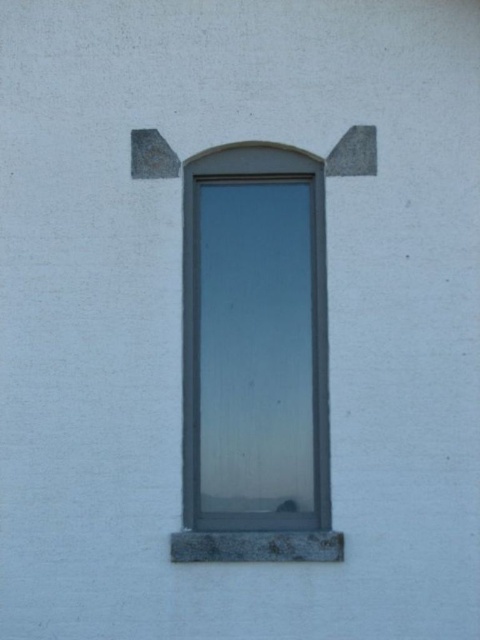
Which of these two, gray stone window frame at center or gray stone window sill at lower center, stands shorter?

Standing shorter between the two is gray stone window sill at lower center.

Does gray stone window frame at center come in front of gray stone window sill at lower center?

No.

Is point (212, 168) more distant than point (199, 561)?

Yes, it is.

The height and width of the screenshot is (640, 480). I want to click on gray stone window frame at center, so click(254, 358).